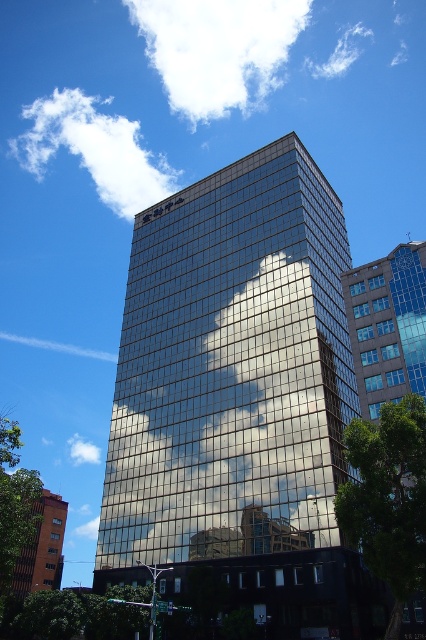
Question: Does white fluffy cloud at upper center appear under orange brick building at lower left?

Choices:
 (A) no
 (B) yes

Answer: (A)

Question: Is white fluffy cloud at upper center to the right of orange brick building at lower left from the viewer's perspective?

Choices:
 (A) no
 (B) yes

Answer: (B)

Question: Which object appears farthest from the camera in this image?

Choices:
 (A) white fluffy cloud at left
 (B) white fluffy cloud at upper center

Answer: (B)

Question: Does reflective glass building at center lie in front of white fluffy cloud at upper center?

Choices:
 (A) no
 (B) yes

Answer: (B)

Question: Which of the following is the farthest from the observer?

Choices:
 (A) white fluffy cloud at left
 (B) white fluffy cloud at upper center

Answer: (B)

Question: Which object appears closest to the camera in this image?

Choices:
 (A) reflective glass building at center
 (B) white fluffy cloud at left
 (C) white fluffy cloud at upper left
 (D) white fluffy cloud at upper center

Answer: (A)